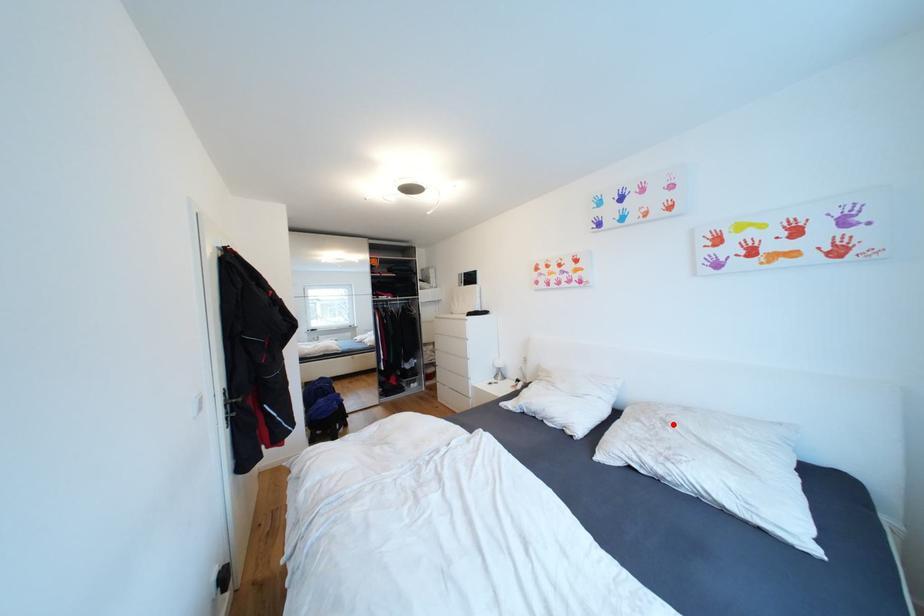
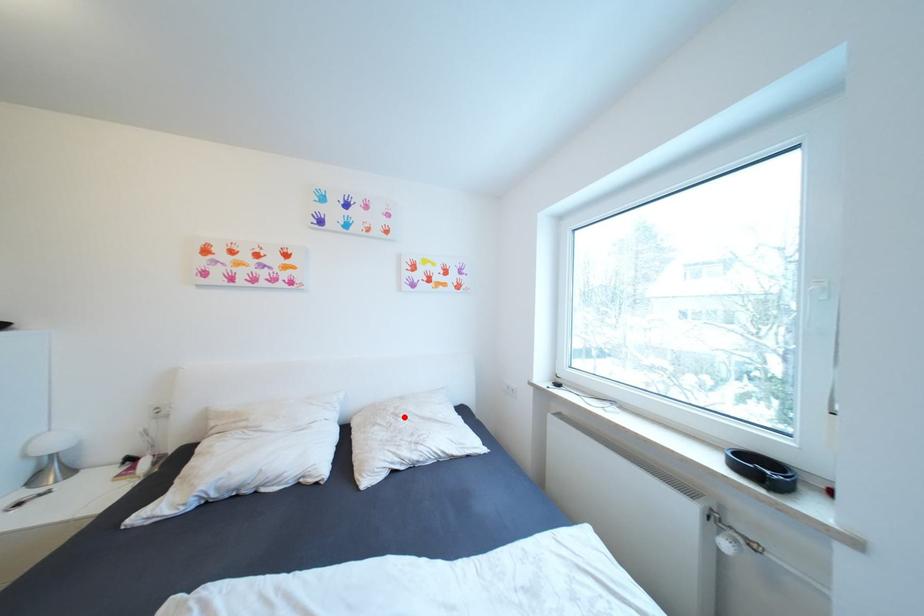
I am providing you with two images of the same scene from different viewpoints. A red point is marked on the first image and another point is marked on the second image. Is the marked point in image1 the same physical position as the marked point in image2?

Yes